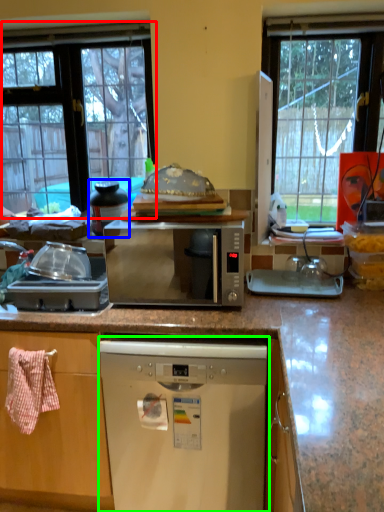
Question: Considering the real-world distances, which object is farthest from window (highlighted by a red box)? appliance (highlighted by a blue box) or dishwasher (highlighted by a green box)?

Choices:
 (A) appliance
 (B) dishwasher

Answer: (B)